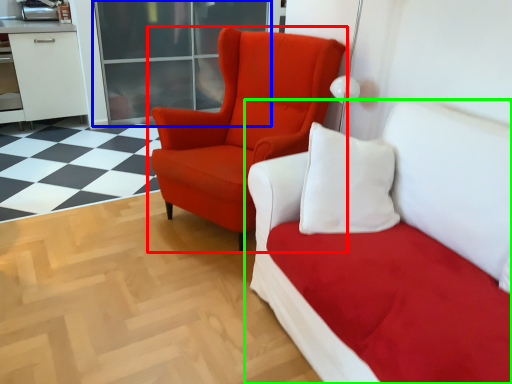
Question: Which object is the closest to the chair (highlighted by a red box)? Choose among these: glass door (highlighted by a blue box) or studio couch (highlighted by a green box).

Choices:
 (A) glass door
 (B) studio couch

Answer: (B)